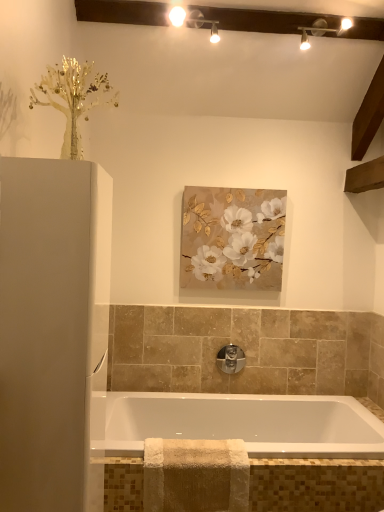
Question: From a real-world perspective, is satin nickel faucet at center positioned above or below white glossy cabinet at left?

Choices:
 (A) below
 (B) above

Answer: (A)

Question: Visually, is satin nickel faucet at center positioned to the left or to the right of white glossy cabinet at left?

Choices:
 (A) right
 (B) left

Answer: (A)

Question: Based on their relative distances, which object is farther from the beige textured towel at lower center?

Choices:
 (A) white glossy cabinet at left
 (B) white glossy bathtub at center
 (C) matte white track lights at upper center
 (D) satin nickel faucet at center
 (E) matte gold and white floral painting at center

Answer: (C)

Question: Which of these objects is positioned farthest from the matte gold and white floral painting at center?

Choices:
 (A) satin nickel faucet at center
 (B) white glossy cabinet at left
 (C) white glossy bathtub at center
 (D) matte white track lights at upper center
 (E) beige textured towel at lower center

Answer: (B)